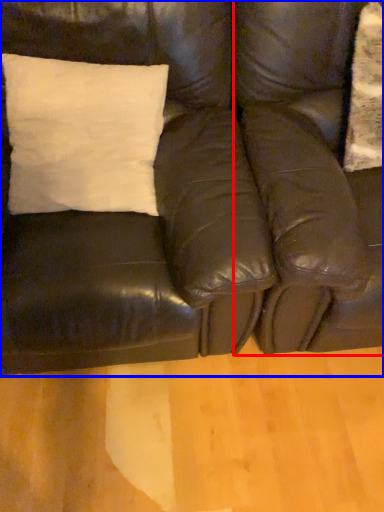
Question: Which of the following is the closest to the observer, swivel chair (highlighted by a red box) or studio couch (highlighted by a blue box)?

Choices:
 (A) swivel chair
 (B) studio couch

Answer: (B)